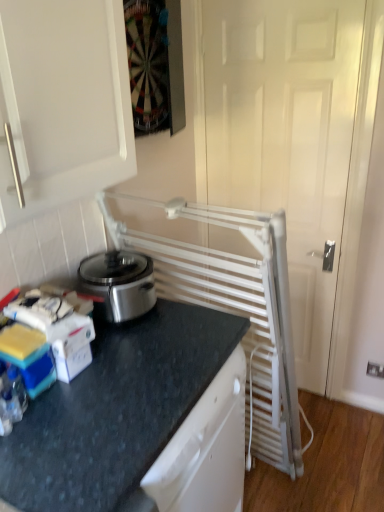
Question: In the image, is white plastic electric outlet at lower right positioned in front of or behind white metallic radiator at right?

Choices:
 (A) front
 (B) behind

Answer: (B)

Question: Is white plastic electric outlet at lower right situated inside white metallic radiator at right or outside?

Choices:
 (A) outside
 (B) inside

Answer: (A)

Question: Which is nearer to the black granite countertop at lower left?

Choices:
 (A) white plastic electric outlet at lower right
 (B) white metallic radiator at right

Answer: (B)

Question: Based on their relative distances, which object is farther from the white plastic electric outlet at lower right?

Choices:
 (A) black granite countertop at lower left
 (B) white metallic radiator at right

Answer: (A)